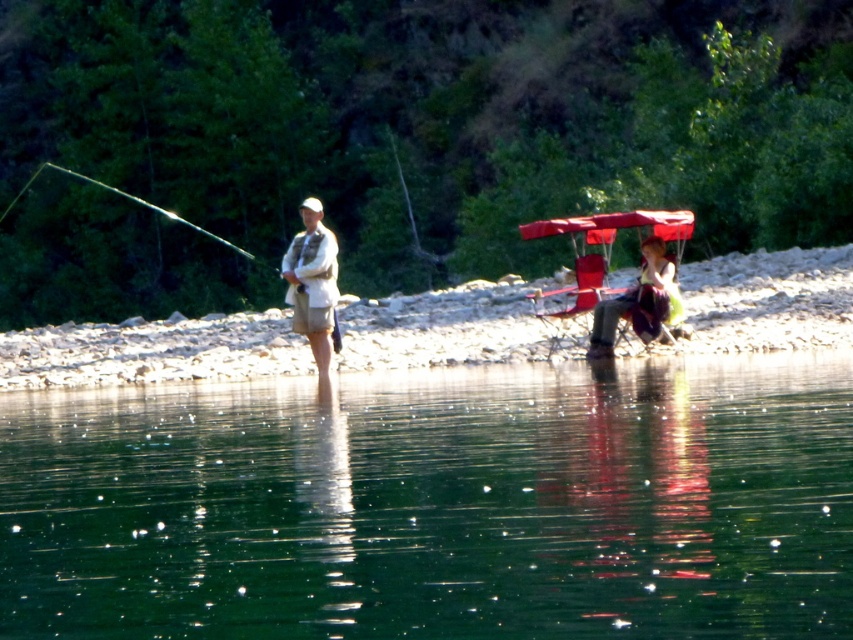
In the scene shown: You are a drone operator tasked with capturing aerial footage of the serene riverside scene. The green reflective water at lower center is crucial for the shot. Based on its coordinates, can you determine if it will be centered in the frame?

The green reflective water at lower center is located at point (437, 502), which is slightly off the center coordinates of (426, 320). Therefore, it will not be perfectly centered in the frame.

Based on the photo, you are a photographer planning to take a photo of the matte white shirt at center and the matte red umbrella at right. Based on their positions, which object should you focus on first to ensure both are in frame without moving the camera?

The matte white shirt at center is taller than the matte red umbrella at right, so focusing on the matte white shirt at center first will help ensure both are in frame since it occupies a larger portion of the viewfinder.

You are a photographer planning to take a photo of the smooth sand shore at center and the matte white shirt at center. Based on their positions, which object should appear closer to the camera in the final photo?

The smooth sand shore at center is in front of the matte white shirt at center, so it will appear closer to the camera in the photo.